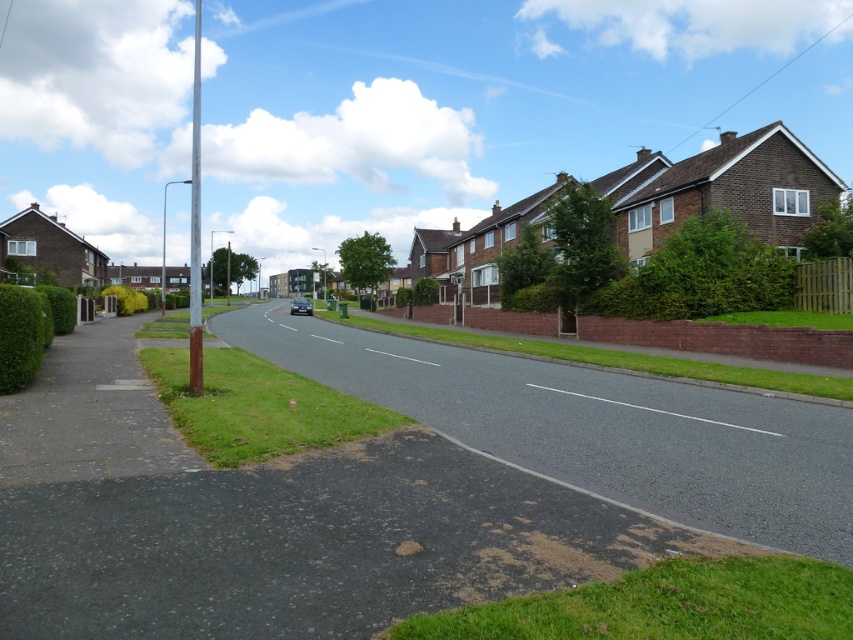
Between point (409, 368) and point (573, 396), which one is positioned behind?

The point (409, 368) is behind.

Between asphalt road at center and smooth asphalt road at center, which one is positioned higher?

Positioned higher is smooth asphalt road at center.

Where is `asphalt road at center`? This screenshot has width=853, height=640. asphalt road at center is located at coordinates (596, 428).